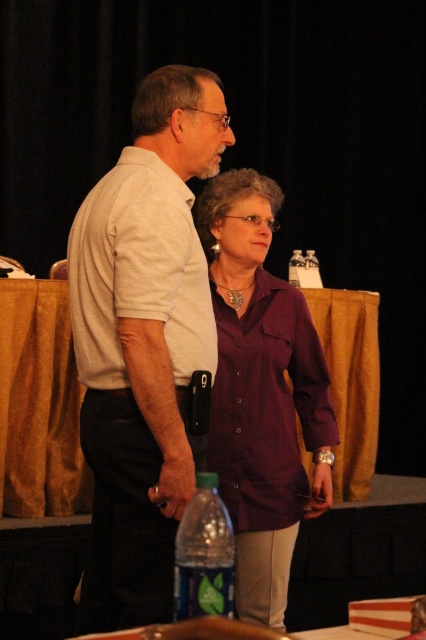
You are a photographer setting up for a group photo. You need to arrange the two people so that their shirts are visible. Given that the white matte shirt at center is thinner than the purple cotton shirt at center, which shirt should be placed closer to the camera to ensure both shirts are fully visible in the photo?

The white matte shirt at center is thinner than the purple cotton shirt at center, so placing the white matte shirt at center closer to the camera will ensure both shirts are fully visible in the photo.

You are a fashion designer observing two shirts in the image. The purple cotton shirt at center and the white cotton shirt at center. Which one has a larger width according to the description?

The purple cotton shirt at center might be wider than white cotton shirt at center, so the purple cotton shirt at center is likely wider.